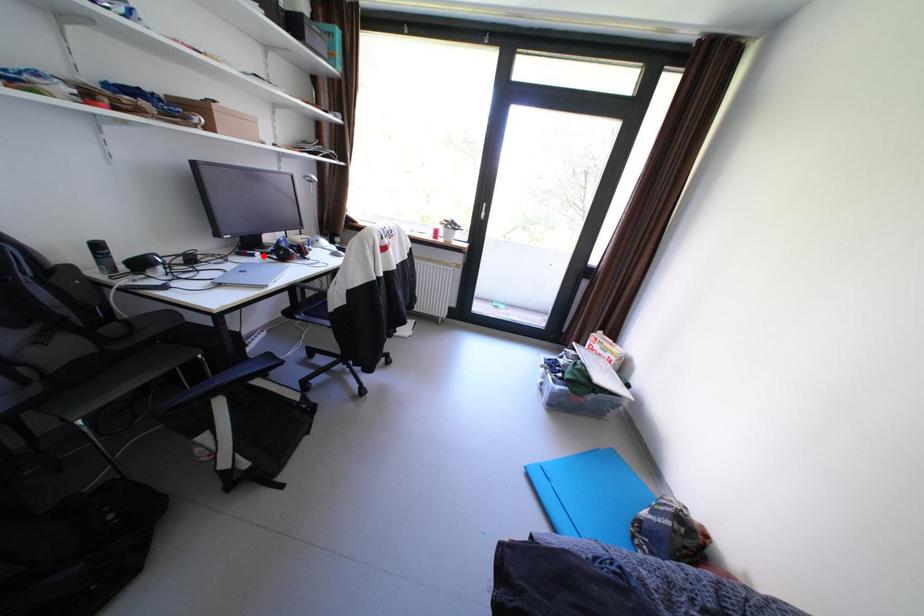
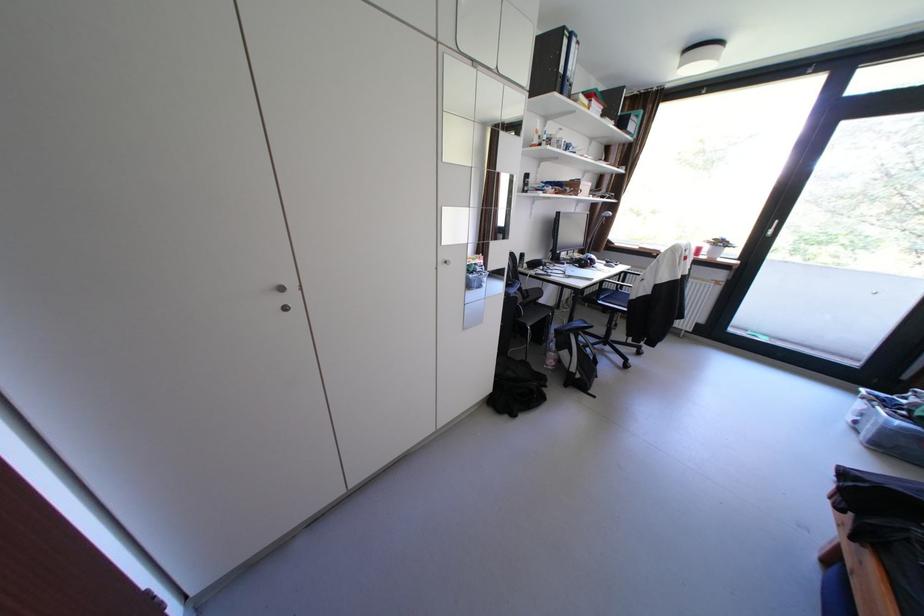
In the second image, find the point that corresponds to the highlighted location in the first image.

(574, 264)